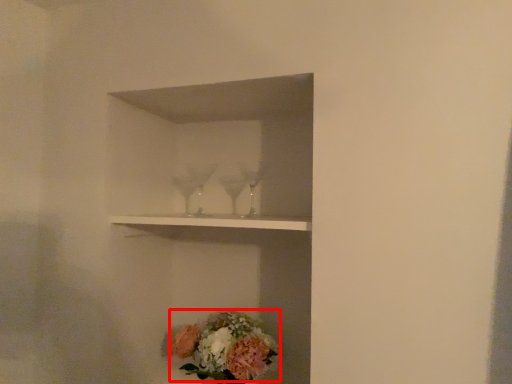
Question: In this image, where is flower (annotated by the red box) located relative to shelf?

Choices:
 (A) left
 (B) right

Answer: (A)